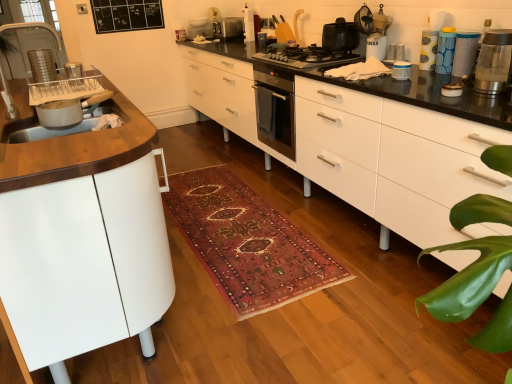
You are a GUI agent. You are given a task and a screenshot of the screen. Output one action in this format:
    pyautogui.click(x=<x>, y=<y>)
    Task: Click on the free space to the left of matte plastic container at upper right, placed as the first appliance when sorted from right to left
    The width and height of the screenshot is (512, 384).
    Given the screenshot: What is the action you would take?
    pyautogui.click(x=441, y=71)